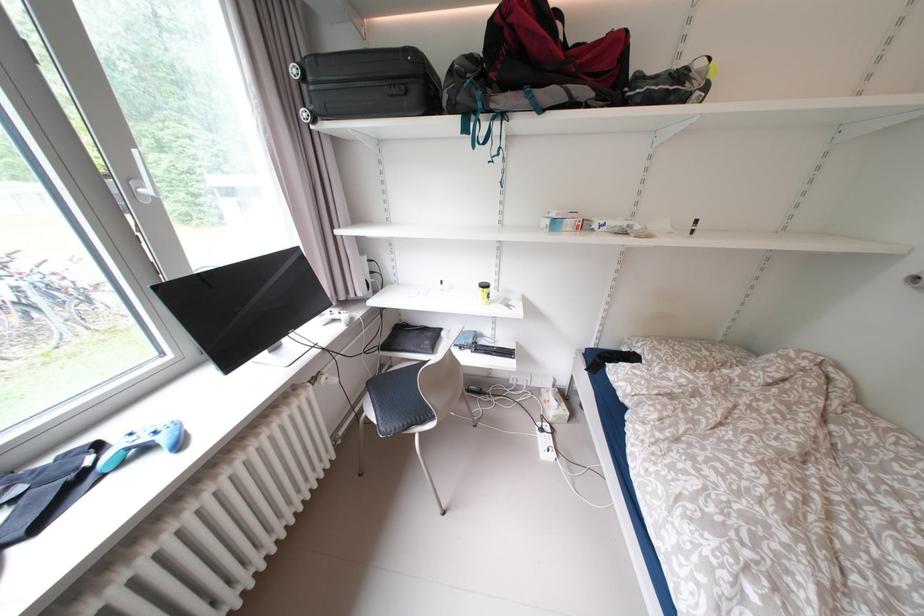
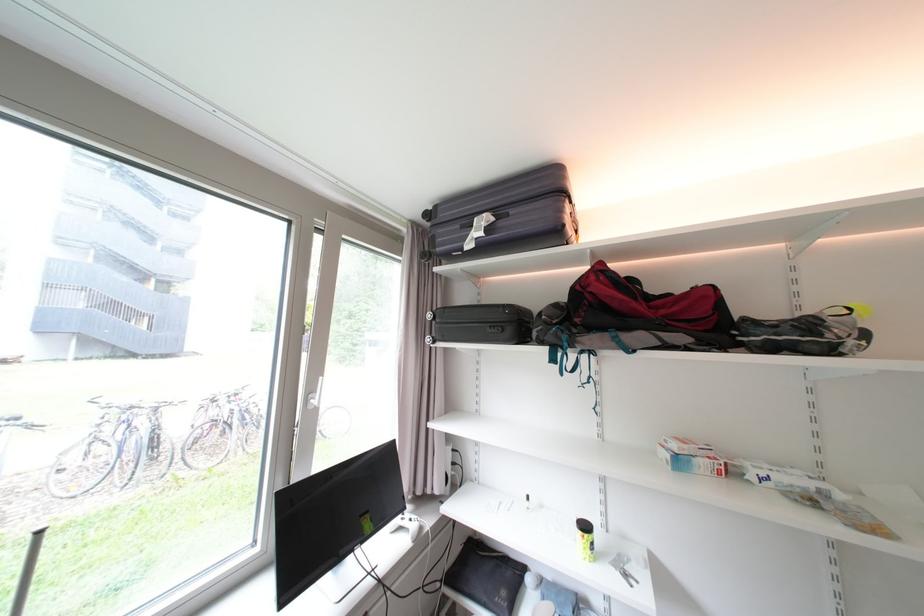
Locate, in the second image, the point that corresponds to point (578, 224) in the first image.

(711, 464)